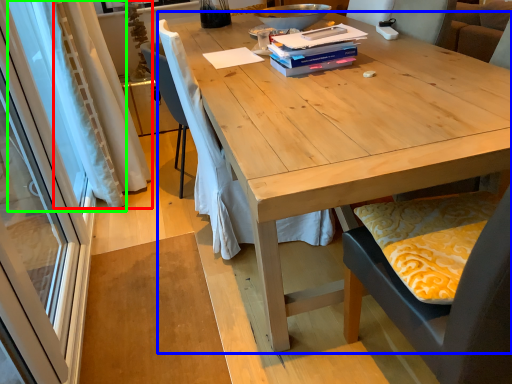
Question: Estimate the real-world distances between objects in this image. Which object is closer to curtain (highlighted by a red box), desk (highlighted by a blue box) or curtain (highlighted by a green box)?

Choices:
 (A) desk
 (B) curtain

Answer: (B)